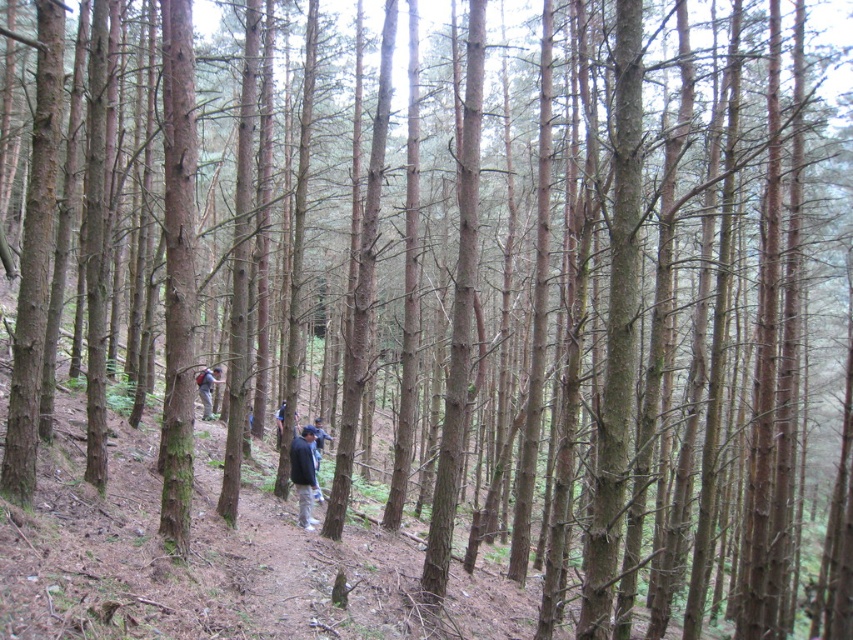
Question: Does dark blue jacket at center appear over dark blue backpack at center?

Choices:
 (A) no
 (B) yes

Answer: (A)

Question: Can you confirm if dark blue jacket at center is smaller than dark blue backpack at center?

Choices:
 (A) no
 (B) yes

Answer: (A)

Question: Which object is closer to the camera taking this photo?

Choices:
 (A) dark blue jacket at center
 (B) dark blue backpack at center

Answer: (A)

Question: Does dark blue jacket at center appear on the left side of dark blue backpack at center?

Choices:
 (A) no
 (B) yes

Answer: (A)